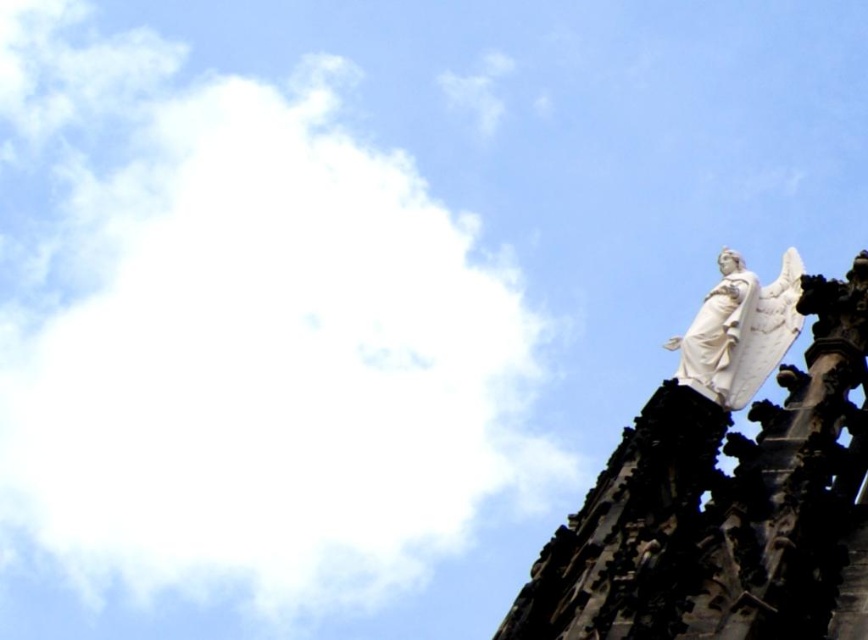
Question: Can you confirm if white fluffy cloud at upper left is wider than white stone angel at upper right?

Choices:
 (A) no
 (B) yes

Answer: (B)

Question: Can you confirm if white fluffy cloud at upper left is wider than white stone angel at upper right?

Choices:
 (A) no
 (B) yes

Answer: (B)

Question: Which point is closer to the camera taking this photo?

Choices:
 (A) (779, 288)
 (B) (461, 465)

Answer: (A)

Question: Is white fluffy cloud at upper left thinner than white stone angel at upper right?

Choices:
 (A) no
 (B) yes

Answer: (A)

Question: Which object is farther from the camera taking this photo?

Choices:
 (A) white fluffy cloud at upper left
 (B) white stone angel at upper right

Answer: (A)